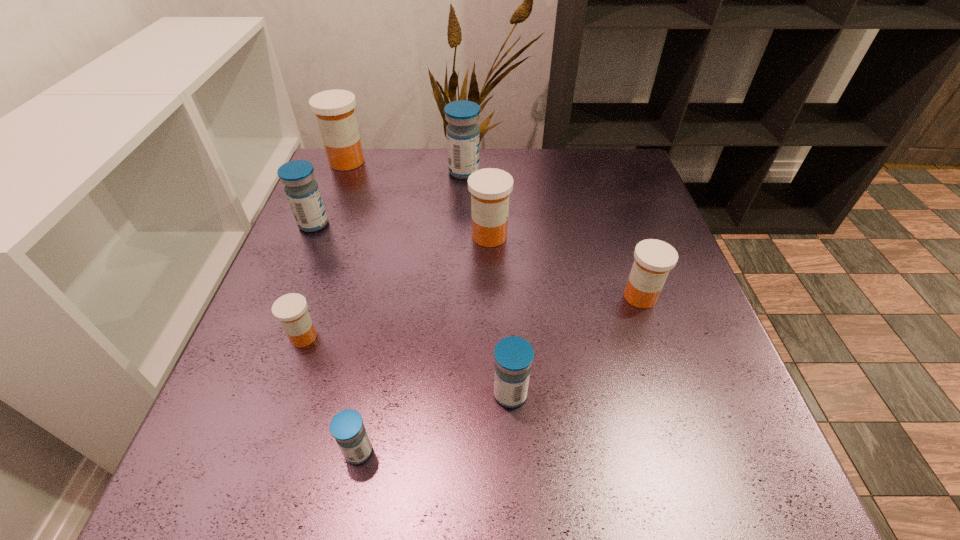
Find the location of a particular element. blank area located 0.180m on the right of the second farthest blue medicine is located at coordinates (405, 224).

I want to click on vacant space positioned 0.110m on the label of the second nearest orange medicine, so click(x=661, y=359).

I want to click on vacant region located on the left of the second nearest object, so point(439,394).

Image resolution: width=960 pixels, height=540 pixels. I want to click on blank space located on the label of the nearest orange medicine, so click(x=411, y=337).

This screenshot has width=960, height=540. I want to click on free spot located 0.130m on the right of the smallest blue medicine, so click(x=459, y=451).

Identify the location of object at the near edge. (347, 427).

Locate an element on the screen. object that is at the right edge is located at coordinates (654, 259).

The height and width of the screenshot is (540, 960). I want to click on object located in the far left corner section of the desktop, so click(334, 109).

You are a GUI agent. You are given a task and a screenshot of the screen. Output one action in this format:
    pyautogui.click(x=<x>, y=<y>)
    Task: Click on the vacant space at the far edge
    
    Given the screenshot: What is the action you would take?
    pyautogui.click(x=442, y=183)

The width and height of the screenshot is (960, 540). I want to click on vacant space at the left edge of the desktop, so click(334, 322).